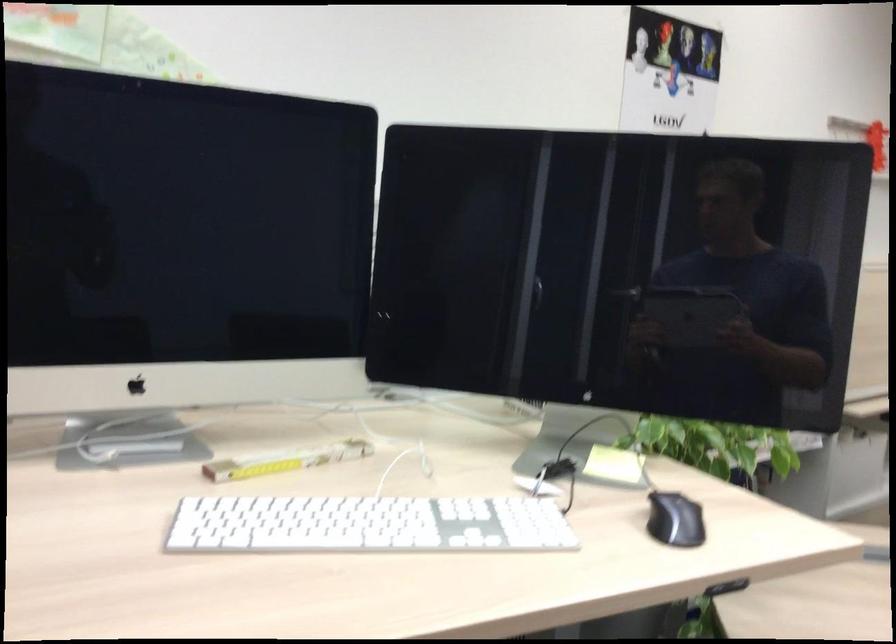
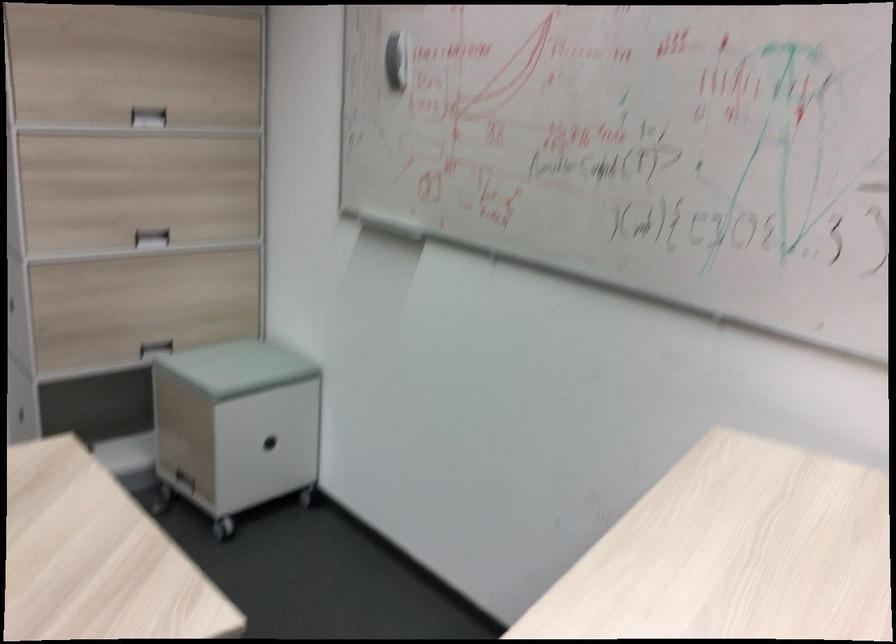
How did the camera likely rotate?

The camera rotated toward right-down.